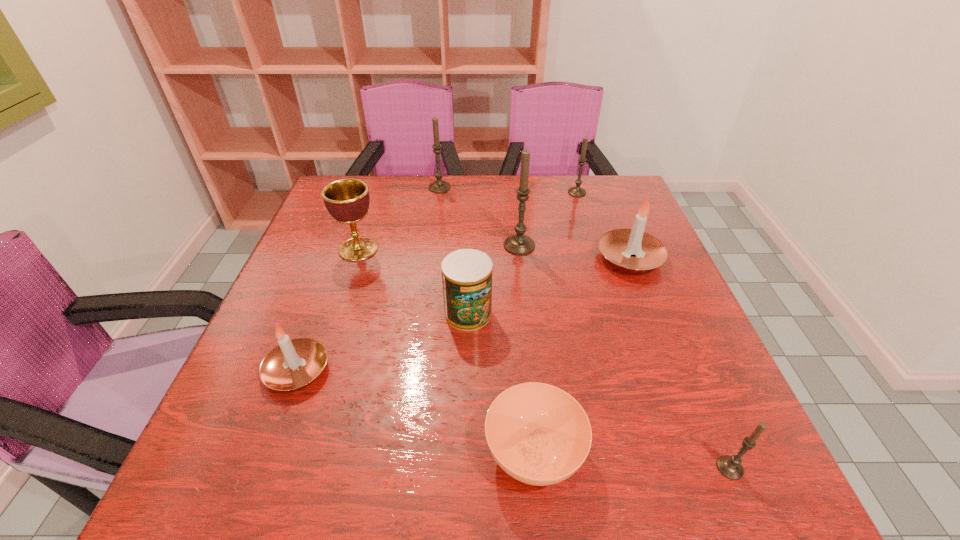
Find the location of a particular element. The width and height of the screenshot is (960, 540). vacant space situated 0.310m on the back of the fourth nearest object is located at coordinates (470, 220).

At what (x,y) coordinates should I click in order to perform the action: click on vacant area situated on the right of the leftmost candle. Please return your answer as a coordinate pair (x, y). The width and height of the screenshot is (960, 540). Looking at the image, I should click on (468, 370).

Locate an element on the screen. This screenshot has height=540, width=960. free space located on the left of the rightmost gray candle is located at coordinates (600, 468).

The width and height of the screenshot is (960, 540). In order to click on free space located 0.120m on the right of the soup bowl in this screenshot , I will do `click(656, 453)`.

Identify the location of candle positioned at the near edge. This screenshot has height=540, width=960. (730, 466).

This screenshot has width=960, height=540. In order to click on soup bowl that is at the near edge in this screenshot , I will do `click(538, 434)`.

I want to click on chalice located at the left edge, so click(347, 200).

You are a GUI agent. You are given a task and a screenshot of the screen. Output one action in this format:
    pyautogui.click(x=<x>, y=<y>)
    Task: Click on the candle present at the left edge
    The image size is (960, 540).
    Given the screenshot: What is the action you would take?
    pyautogui.click(x=292, y=364)

Where is `object that is at the far right corner`? object that is at the far right corner is located at coordinates (577, 191).

What are the coordinates of `object located in the near right corner section of the desktop` in the screenshot? It's located at (730, 466).